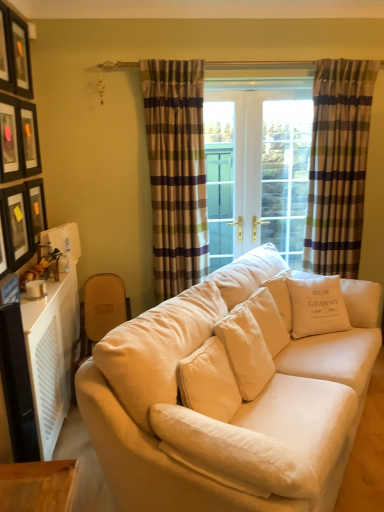
Question: From the image's perspective, is beige fabric couch at center located beneath matte black picture frame at upper left, which is the 2th picture frame from top to bottom?

Choices:
 (A) yes
 (B) no

Answer: (A)

Question: Does beige fabric couch at center have a greater width compared to matte black picture frame at upper left, arranged as the fifth picture frame when ordered from the bottom?

Choices:
 (A) yes
 (B) no

Answer: (A)

Question: From the image's perspective, is beige fabric couch at center on matte black picture frame at upper left, arranged as the fifth picture frame when ordered from the bottom?

Choices:
 (A) yes
 (B) no

Answer: (B)

Question: Is beige fabric couch at center not inside matte black picture frame at upper left, arranged as the fifth picture frame when ordered from the bottom?

Choices:
 (A) no
 (B) yes

Answer: (B)

Question: Considering the relative sizes of beige fabric couch at center and matte black picture frame at upper left, arranged as the fifth picture frame when ordered from the bottom, in the image provided, is beige fabric couch at center taller than matte black picture frame at upper left, arranged as the fifth picture frame when ordered from the bottom,?

Choices:
 (A) yes
 (B) no

Answer: (A)

Question: Is beige fabric couch at center not near matte black picture frame at upper left, which is the 2th picture frame from top to bottom?

Choices:
 (A) yes
 (B) no

Answer: (A)

Question: From the image's perspective, does plaid fabric curtain at center, which ranks as the 1th curtain in left-to-right order, appear higher than matte black picture frame at upper left, arranged as the fifth picture frame when ordered from the bottom?

Choices:
 (A) yes
 (B) no

Answer: (B)

Question: Is plaid fabric curtain at center, which ranks as the 1th curtain in left-to-right order, closer to camera compared to matte black picture frame at upper left, arranged as the fifth picture frame when ordered from the bottom?

Choices:
 (A) yes
 (B) no

Answer: (B)

Question: Considering the relative positions of plaid fabric curtain at center, which ranks as the 1th curtain in left-to-right order, and matte black picture frame at upper left, arranged as the fifth picture frame when ordered from the bottom, in the image provided, is plaid fabric curtain at center, which ranks as the 1th curtain in left-to-right order, to the left of matte black picture frame at upper left, arranged as the fifth picture frame when ordered from the bottom, from the viewer's perspective?

Choices:
 (A) no
 (B) yes

Answer: (A)

Question: Is plaid fabric curtain at center, which ranks as the 1th curtain in left-to-right order, far away from matte black picture frame at upper left, arranged as the fifth picture frame when ordered from the bottom?

Choices:
 (A) yes
 (B) no

Answer: (A)

Question: Is plaid fabric curtain at center, which is the second curtain from right to left, shorter than matte black picture frame at upper left, which is the 2th picture frame from top to bottom?

Choices:
 (A) no
 (B) yes

Answer: (A)

Question: Is plaid fabric curtain at center, which ranks as the 1th curtain in left-to-right order, further to the viewer compared to matte black picture frame at upper left, arranged as the fifth picture frame when ordered from the bottom?

Choices:
 (A) no
 (B) yes

Answer: (B)

Question: Is matte black picture frame at upper left, the 1th picture frame when ordered from top to bottom, not near matte black picture frame at upper left, acting as the 3th picture frame starting from the bottom?

Choices:
 (A) no
 (B) yes

Answer: (A)